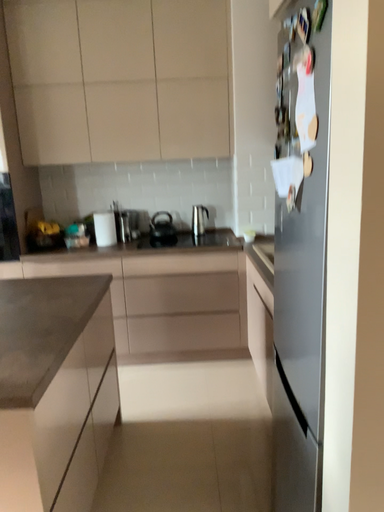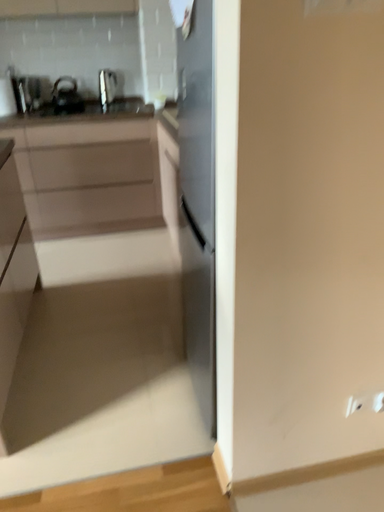
Question: How did the camera likely rotate when shooting the video?

Choices:
 (A) rotated upward
 (B) rotated downward

Answer: (B)